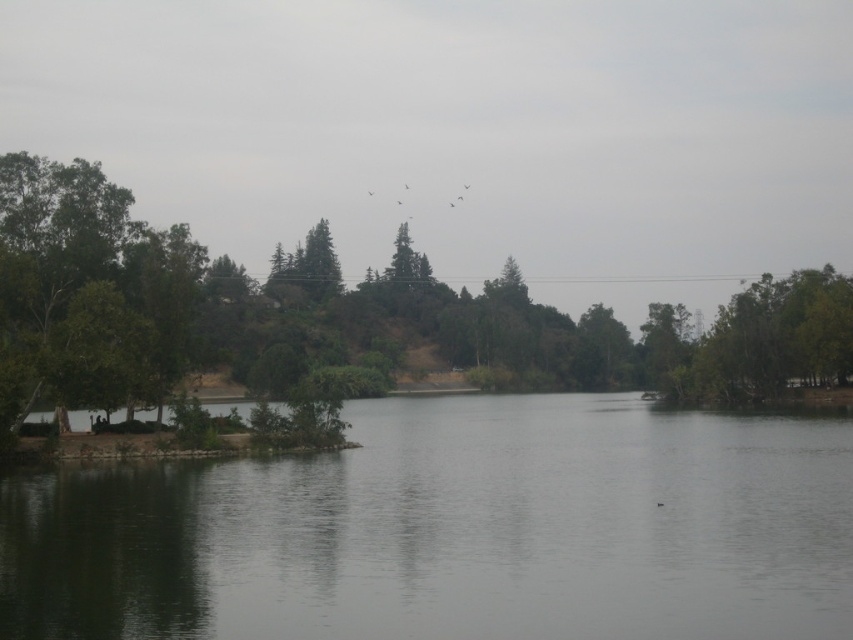
The image size is (853, 640). In order to click on smooth gray water at center in this screenshot , I will do pyautogui.click(x=453, y=531).

Who is more distant from viewer, (762,449) or (91,209)?

The point (91,209) is more distant.

Where is `smooth gray water at center`? smooth gray water at center is located at coordinates (453, 531).